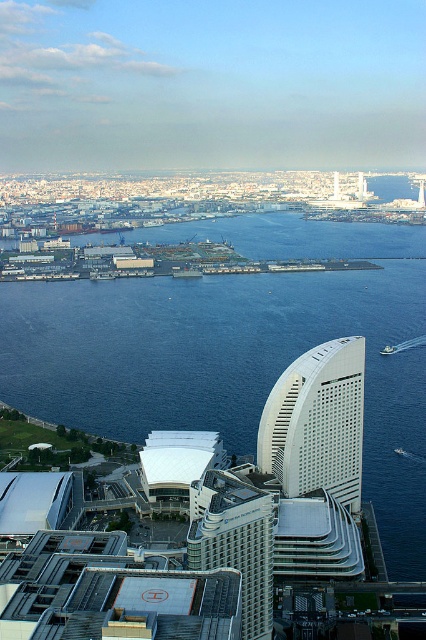
Question: Which point is farther to the camera?

Choices:
 (A) (284, 358)
 (B) (267, 422)
 (C) (213, 500)

Answer: (A)

Question: Which object appears closest to the camera in this image?

Choices:
 (A) white textured building at center
 (B) white textured building at center-right

Answer: (A)

Question: From the image, what is the correct spatial relationship of white textured building at center-right in relation to white textured building at center?

Choices:
 (A) left
 (B) right

Answer: (B)

Question: Can you confirm if blue water at center is smaller than white textured building at center?

Choices:
 (A) no
 (B) yes

Answer: (A)

Question: Is blue water at center wider than white textured building at center-right?

Choices:
 (A) yes
 (B) no

Answer: (A)

Question: Based on their relative distances, which object is nearer to the blue water at center?

Choices:
 (A) white textured building at center-right
 (B) white textured building at center

Answer: (A)